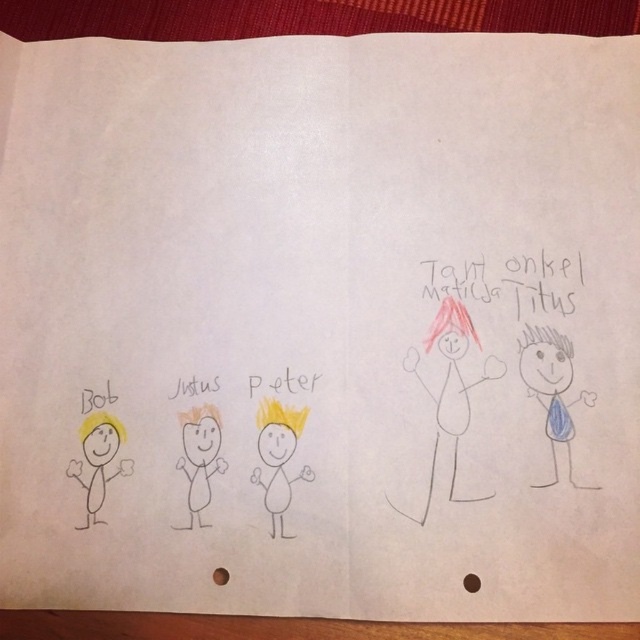
Between colored pencil stick figure at upper right and blue paper at right, which one appears on the left side from the viewer's perspective?

Positioned to the left is colored pencil stick figure at upper right.

Who is more distant from viewer, [451,296] or [540,364]?

The point [451,296] is more distant.

Is point (440, 333) farther from viewer compared to point (531, 484)?

Yes, it is behind point (531, 484).

Identify the location of colored pencil stick figure at upper right. (451, 385).

Between white paper at center and yellow paper at bottom left, which one appears on the left side from the viewer's perspective?

Positioned to the left is yellow paper at bottom left.

Which of these two, white paper at center or yellow paper at bottom left, stands shorter?

With less height is yellow paper at bottom left.

Which is behind, point (177, 529) or point (92, 396)?

The point (92, 396) is more distant.

Find the location of a particular element. white paper at center is located at coordinates tap(198, 458).

Does colored pencil stick figure at upper right have a smaller size compared to yellow paper at left?

Incorrect, colored pencil stick figure at upper right is not smaller in size than yellow paper at left.

Where is `colored pencil stick figure at upper right`? colored pencil stick figure at upper right is located at coordinates (451, 385).

Describe the element at coordinates (451, 385) in the screenshot. The image size is (640, 640). I see `colored pencil stick figure at upper right` at that location.

Identify the location of colored pencil stick figure at upper right. (451, 385).